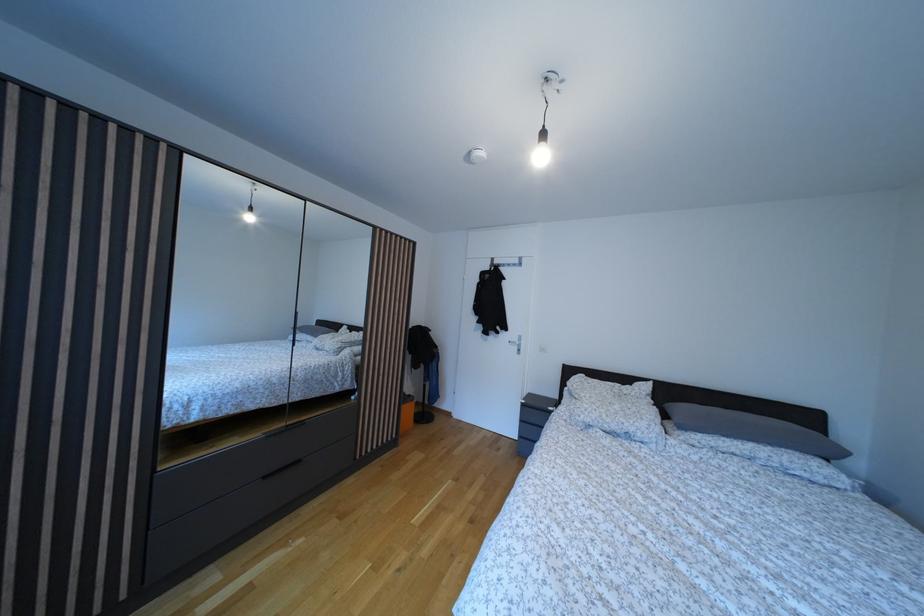
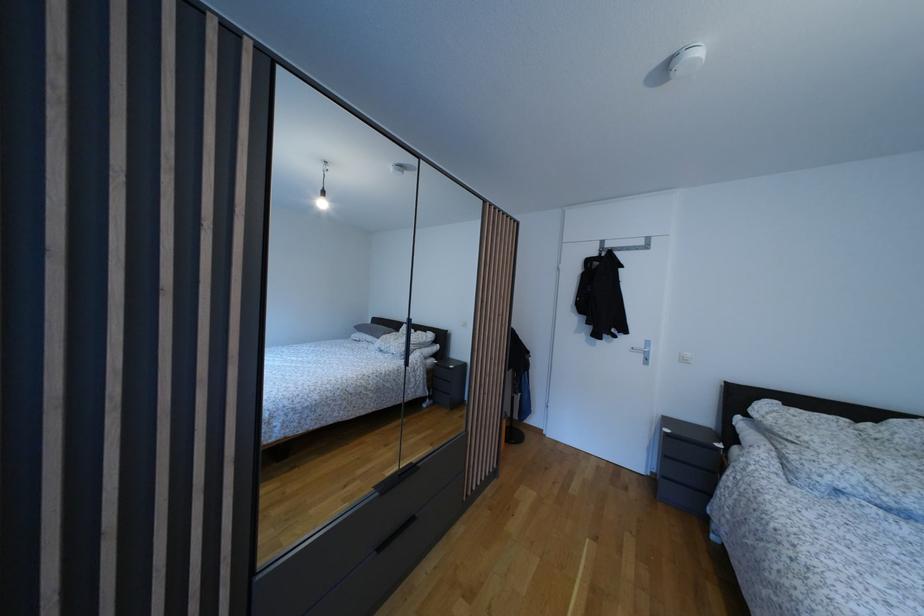
Question: Based on the continuous images, in which direction is the camera rotating? Reply with the corresponding letter.

Choices:
 (A) Left
 (B) Right
 (C) Up
 (D) Down

Answer: (A)